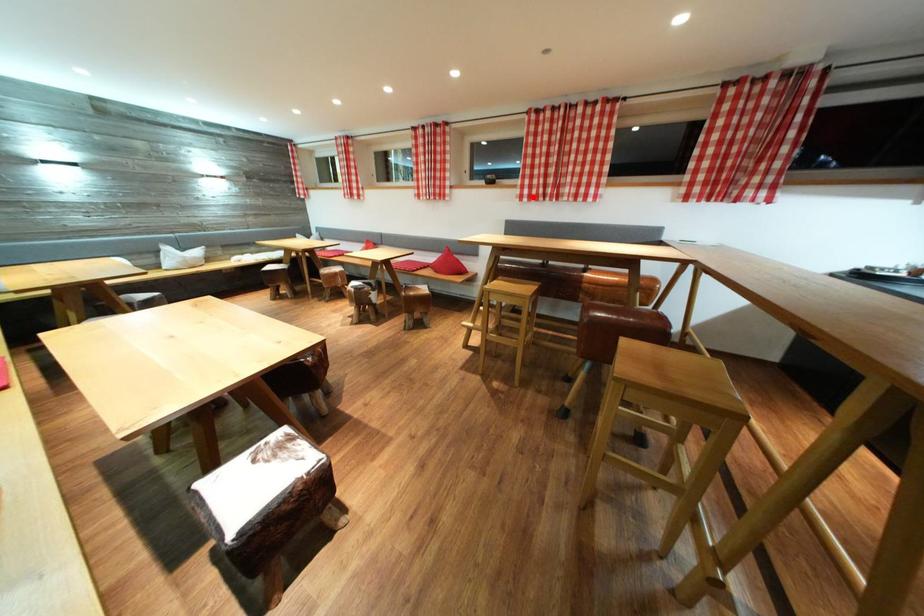
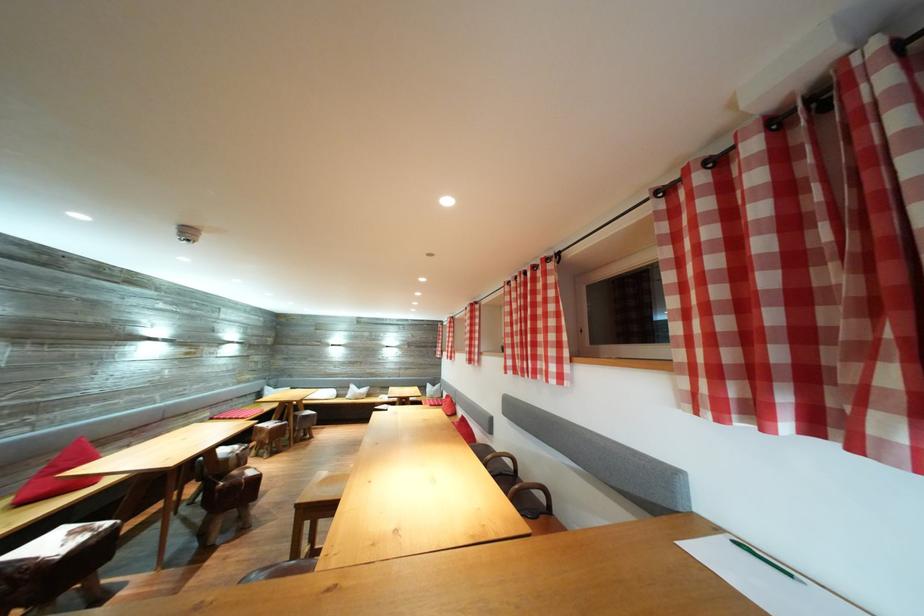
Find the pixel in the second image that matches the highlighted location in the first image.

(517, 368)